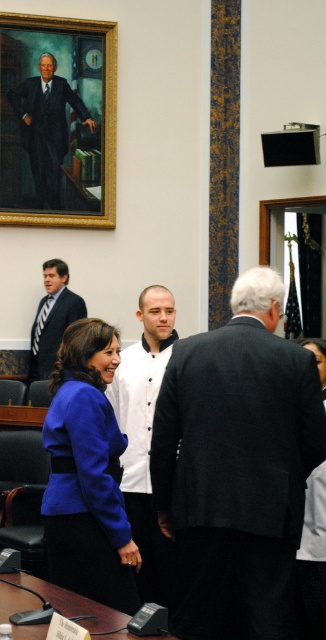
You are a tailor measuring clothing items in a government chamber. You see the black textured suit at center and the white matte shirt at center. Which clothing item requires more fabric to make?

The black textured suit at center requires more fabric because it is bigger than the white matte shirt at center.

You are an interior designer tasked with placing a decorative item on the desk in this legislative chamber. The desk is positioned where the white matte shirt at center is currently located. If you want to place the item exactly where the shirt is, would you need to adjust its position based on the existing layout?

The white matte shirt at center is located at point (145,435), so placing the decorative item at that coordinate would align with the shirt without needing adjustments.

You are standing in the legislative chamber and need to determine which of the two points, point (167, 545) or point (58, 164), is nearer to you. Which one is closer?

Point (167, 545) is closer to the camera than point (58, 164), so it is the closer one.